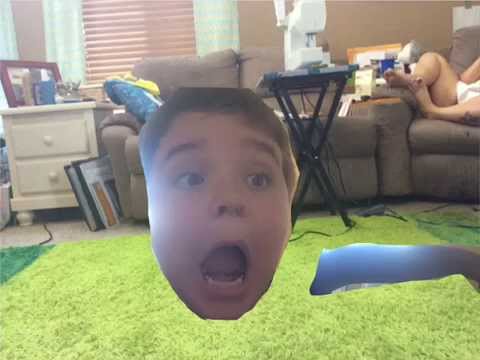
Where is `frame`? frame is located at coordinates (6, 91).